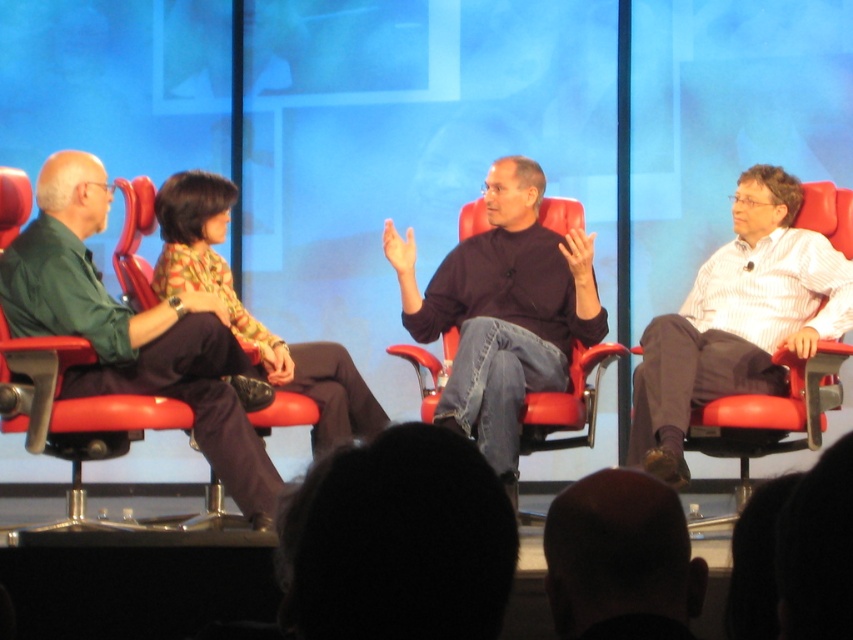
Who is more distant from viewer, (601, 499) or (260, 333)?

Positioned behind is point (260, 333).

Is bald head at center bigger than printed fabric blouse at center?

No, bald head at center is not bigger than printed fabric blouse at center.

Does point (659, 515) come farther from viewer compared to point (210, 202)?

That is False.

Find the location of `bald head at center`. bald head at center is located at coordinates (619, 554).

Between green fabric shirt at left and dark brown sweater at center, which one is positioned higher?

Positioned higher is dark brown sweater at center.

Measure the distance from green fabric shirt at left to dark brown sweater at center.

3.42 feet

Describe the element at coordinates (132, 330) in the screenshot. The image size is (853, 640). I see `green fabric shirt at left` at that location.

Where is `green fabric shirt at left`? green fabric shirt at left is located at coordinates (132, 330).

Measure the distance from green fabric shirt at left to printed fabric blouse at center.

18.58 inches

Which is below, green fabric shirt at left or printed fabric blouse at center?

Positioned lower is green fabric shirt at left.

Where is `green fabric shirt at left`? This screenshot has height=640, width=853. green fabric shirt at left is located at coordinates (132, 330).